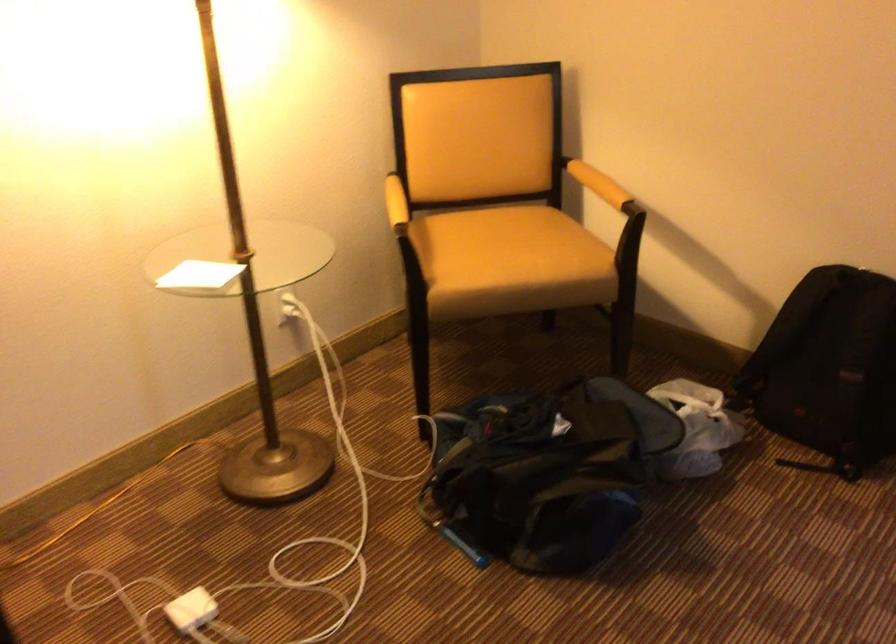
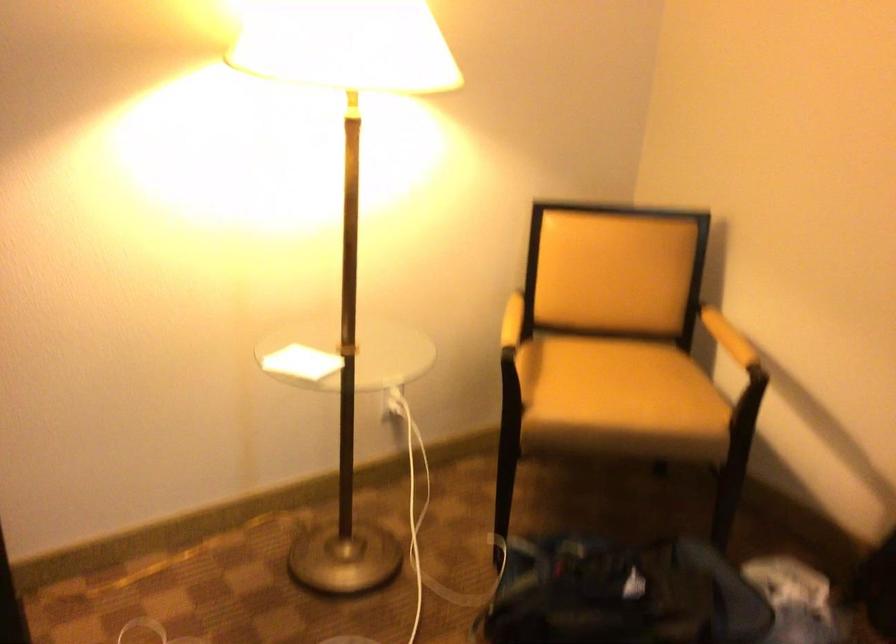
The point at (513, 250) is marked in the first image. Where is the corresponding point in the second image?

(618, 388)